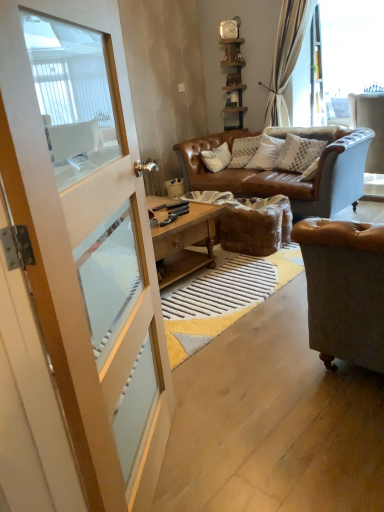
Question: Should I look upward or downward to see white textured pillow at center?

Choices:
 (A) down
 (B) up

Answer: (B)

Question: From a real-world perspective, is white textured pillow at center located higher than transparent glass window at upper right?

Choices:
 (A) no
 (B) yes

Answer: (A)

Question: Is transparent glass window at upper right completely or partially inside white textured pillow at center?

Choices:
 (A) no
 (B) yes

Answer: (A)

Question: From a real-world perspective, is white textured pillow at center below transparent glass window at upper right?

Choices:
 (A) yes
 (B) no

Answer: (A)

Question: Considering the relative positions of white textured pillow at center and transparent glass window at upper right in the image provided, is white textured pillow at center to the right of transparent glass window at upper right from the viewer's perspective?

Choices:
 (A) no
 (B) yes

Answer: (A)

Question: Does white textured pillow at center have a smaller size compared to transparent glass window at upper right?

Choices:
 (A) yes
 (B) no

Answer: (A)

Question: Does white textured pillow at center turn towards transparent glass window at upper right?

Choices:
 (A) no
 (B) yes

Answer: (A)

Question: Can you confirm if white leather chair at right is wider than transparent glass window at upper right?

Choices:
 (A) no
 (B) yes

Answer: (B)

Question: Is white leather chair at right to the left of transparent glass window at upper right from the viewer's perspective?

Choices:
 (A) no
 (B) yes

Answer: (B)

Question: Considering the relative sizes of white leather chair at right and transparent glass window at upper right in the image provided, is white leather chair at right thinner than transparent glass window at upper right?

Choices:
 (A) no
 (B) yes

Answer: (A)

Question: Can you confirm if white leather chair at right is shorter than transparent glass window at upper right?

Choices:
 (A) no
 (B) yes

Answer: (B)

Question: Is white leather chair at right smaller than transparent glass window at upper right?

Choices:
 (A) yes
 (B) no

Answer: (B)

Question: Considering the relative positions of white leather chair at right and transparent glass window at upper right in the image provided, is white leather chair at right in front of transparent glass window at upper right?

Choices:
 (A) yes
 (B) no

Answer: (A)

Question: From a real-world perspective, is metallic wall clock at upper center under white wood screen door at left?

Choices:
 (A) no
 (B) yes

Answer: (A)